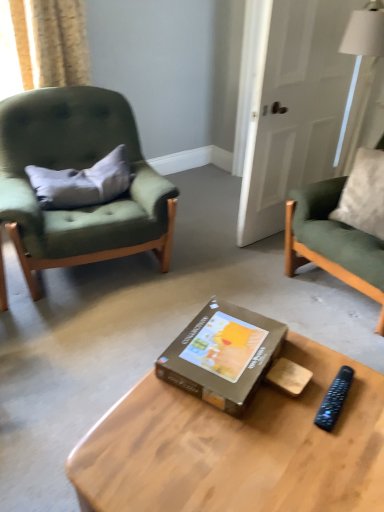
I want to click on free spot in front of black plastic remote at lower right, so click(345, 450).